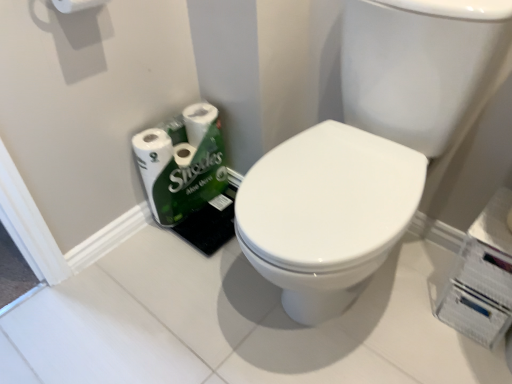
Question: Can you confirm if white glossy toilet paper at lower left, the second toilet paper positioned from the front, is bigger than white glossy sink at center?

Choices:
 (A) no
 (B) yes

Answer: (A)

Question: Is white glossy toilet paper at lower left, the second toilet paper positioned from the front, outside white glossy sink at center?

Choices:
 (A) no
 (B) yes

Answer: (B)

Question: Is white glossy toilet paper at lower left, which is counted as the second toilet paper, starting from the top, facing away from white glossy sink at center?

Choices:
 (A) no
 (B) yes

Answer: (A)

Question: Can you see white glossy toilet paper at lower left, arranged as the first toilet paper when ordered from the bottom, touching white glossy sink at center?

Choices:
 (A) no
 (B) yes

Answer: (A)

Question: Can you confirm if white glossy toilet paper at lower left, the second toilet paper positioned from the front, is shorter than white glossy sink at center?

Choices:
 (A) yes
 (B) no

Answer: (A)

Question: Could white glossy sink at center be considered to be inside white glossy toilet paper at lower left, the first toilet paper when ordered from back to front?

Choices:
 (A) no
 (B) yes

Answer: (A)

Question: Can you confirm if white glossy sink at center is smaller than white glossy toilet paper at lower left, the first toilet paper when ordered from back to front?

Choices:
 (A) yes
 (B) no

Answer: (B)

Question: Could white glossy toilet paper at lower left, arranged as the first toilet paper when ordered from the bottom, be considered to be inside white glossy sink at center?

Choices:
 (A) no
 (B) yes

Answer: (A)

Question: Is white glossy sink at center at the left side of white glossy toilet paper at lower left, which is counted as the second toilet paper, starting from the top?

Choices:
 (A) no
 (B) yes

Answer: (A)

Question: Can you confirm if white glossy sink at center is bigger than white glossy toilet paper at lower left, which is counted as the second toilet paper, starting from the top?

Choices:
 (A) no
 (B) yes

Answer: (B)

Question: Can we say white glossy sink at center lies outside white glossy toilet paper at lower left, the second toilet paper positioned from the front?

Choices:
 (A) yes
 (B) no

Answer: (A)

Question: Is white glossy sink at center positioned behind white glossy toilet paper at lower left, the second toilet paper positioned from the front?

Choices:
 (A) yes
 (B) no

Answer: (B)

Question: Is white glossy toilet paper at lower left, the second toilet paper positioned from the front, beside white matte toilet paper at upper left, marked as the first toilet paper in a front-to-back arrangement?

Choices:
 (A) yes
 (B) no

Answer: (B)